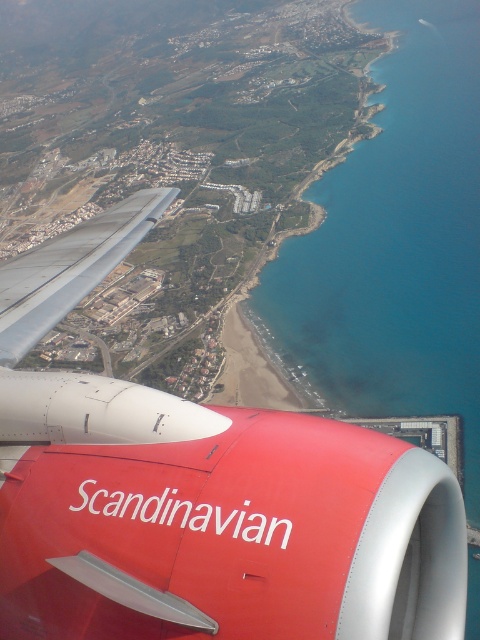
You are a passenger on the Scandinavian Airlines plane and looking out the window. You see the red matte airplane engine at lower left and the blue water at lower center. Which object appears narrower in the window view?

The red matte airplane engine at lower left appears narrower than the blue water at lower center because it has a lesser width compared to it.

You are a passenger on a Scandinavian Airlines flight and looking out the window. You see two points marked on the window at coordinates point (57, 316) and point (464, 244). Which point shows a closer view of the coastal landscape below?

Point (57, 316) is in front of point (464, 244), so the closer view of the coastal landscape is at point (57, 316).